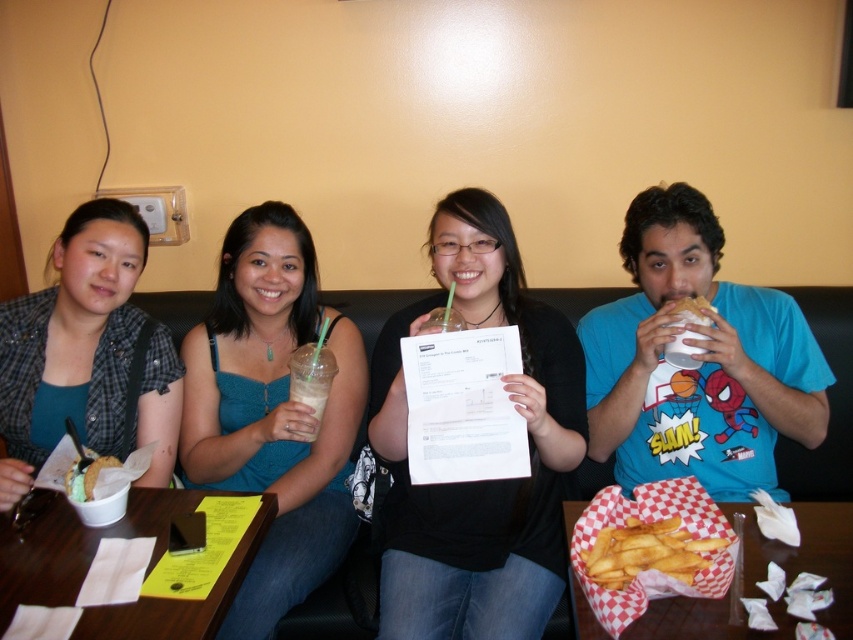
Question: Which of the following is the farthest from the observer?

Choices:
 (A) (606, 552)
 (B) (212, 596)

Answer: (A)

Question: Does black matte paper at center appear over teal fabric dress at center?

Choices:
 (A) yes
 (B) no

Answer: (A)

Question: Does checkered paper tray of fries at lower right have a smaller size compared to iced coffee at center?

Choices:
 (A) yes
 (B) no

Answer: (B)

Question: Does white paper napkin at lower left have a larger size compared to checkered paper tray of fries at lower right?

Choices:
 (A) no
 (B) yes

Answer: (A)

Question: Among these points, which one is nearest to the camera?

Choices:
 (A) (401, 536)
 (B) (807, 524)
 (C) (18, 580)

Answer: (C)

Question: Which of the following is the farthest from the observer?

Choices:
 (A) (177, 396)
 (B) (631, 560)
 (C) (814, 541)

Answer: (A)